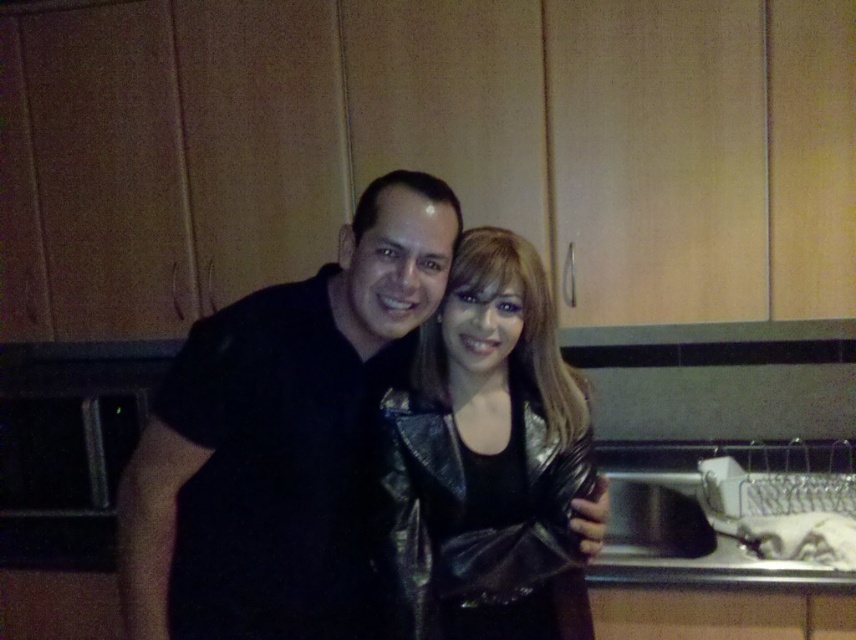
Measure the distance between black leather jacket at center and camera.

black leather jacket at center is 1.14 meters from camera.

Is black leather jacket at center positioned in front of shiny metallic jacket at center?

Yes.

Between point (144, 433) and point (479, 605), which one is positioned behind?

Positioned behind is point (479, 605).

This screenshot has width=856, height=640. What are the coordinates of `black leather jacket at center` in the screenshot? It's located at (282, 440).